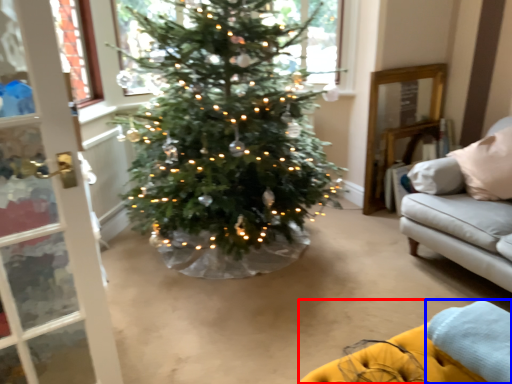
Question: Which point is closer to the camera, couch (highlighted by a red box) or blanket (highlighted by a blue box)?

Choices:
 (A) couch
 (B) blanket

Answer: (A)